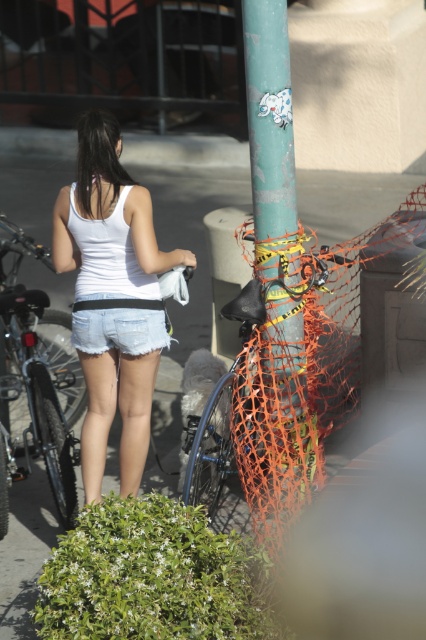
You are a photographer trying to capture the woman in the scene. You want to make sure the shiny metallic bicycle at left is visible in the background behind the white denim shorts at center. Is the bicycle positioned in a way that allows this?

The white denim shorts at center is to the right of the shiny metallic bicycle at left, so the bicycle is positioned to the left of the woman and the shorts. This means the bicycle is behind the woman and her shorts, making it visible in the background.

Based on the scene description, if the shiny metallic bicycle at left is positioned below the denim shorts at center, which object would an observer see first when looking down from the top of the scene?

The observer would first see the shiny metallic bicycle at left because it is positioned below the denim shorts at center, meaning it is lower in the visual hierarchy.

You are a delivery person trying to navigate through the scene. You need to pass between the white denim shorts at center and the green matte pole at center. Which object should you move closer to in order to get past them?

To navigate between the white denim shorts at center and the green matte pole at center, you should move closer to the green matte pole at center since the white denim shorts at center is closer to you and the pole is further back, creating space to maneuver around the shorts.